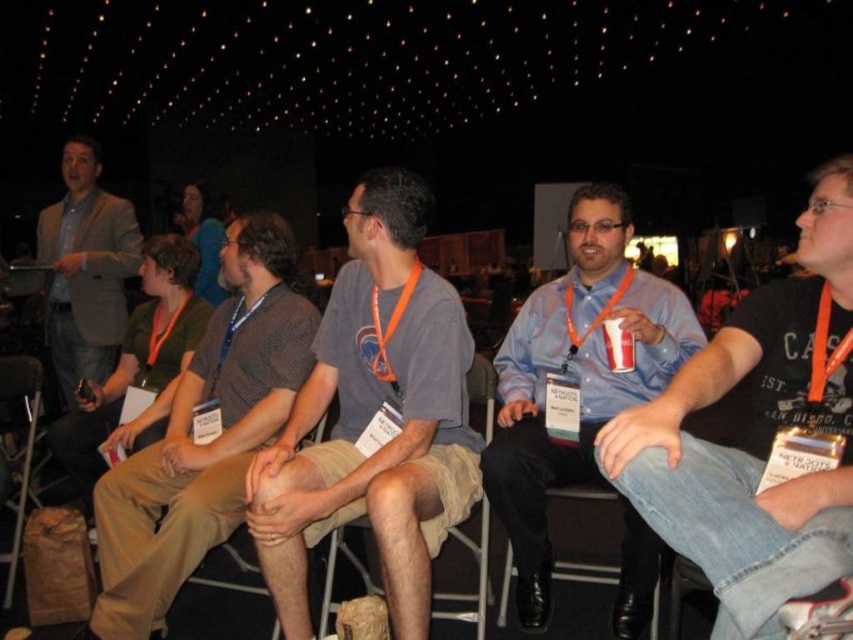
Question: Which of the following is the closest to the observer?

Choices:
 (A) khaki cotton pants at center
 (B) matte gray blazer at upper left
 (C) tan fabric chair at center

Answer: (A)

Question: Observing the image, what is the correct spatial positioning of matte gray blazer at upper left in reference to green cotton shirt at left?

Choices:
 (A) below
 (B) above

Answer: (A)

Question: Which point is closer to the camera taking this photo?

Choices:
 (A) (84, 298)
 (B) (451, 378)
 (C) (149, 316)

Answer: (B)

Question: Does matte gray blazer at upper left have a larger size compared to tan fabric chair at center?

Choices:
 (A) yes
 (B) no

Answer: (A)

Question: Which of the following is the closest to the observer?

Choices:
 (A) green cotton shirt at left
 (B) tan fabric chair at center
 (C) dark brown hair at center
 (D) khaki cotton pants at center

Answer: (D)

Question: Is gray cotton t-shirt at center behind dark brown hair at center?

Choices:
 (A) yes
 (B) no

Answer: (B)